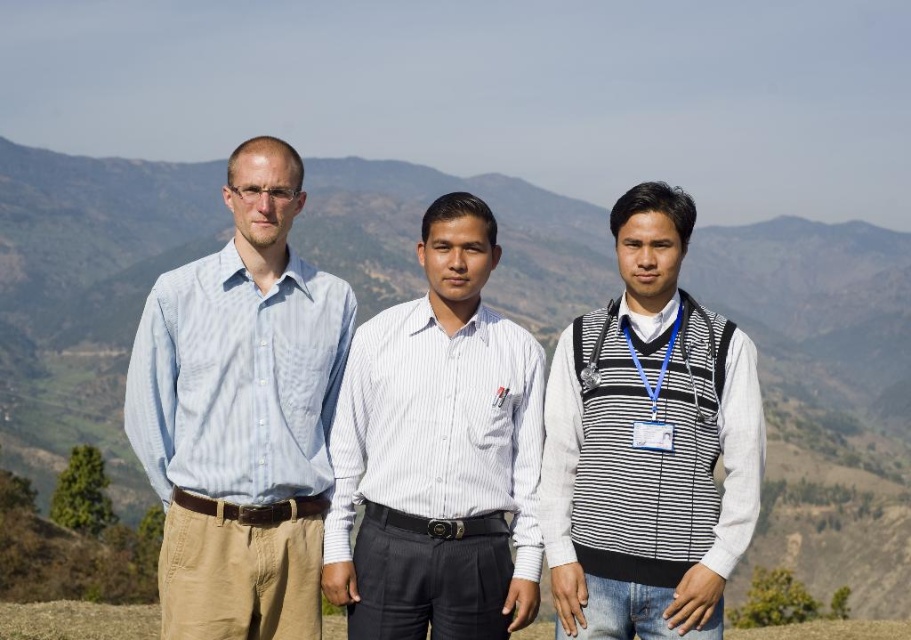
Question: Which object is closer to the camera taking this photo?

Choices:
 (A) silver metallic medal at center
 (B) striped sweater vest at center
 (C) white striped shirt at center

Answer: (B)

Question: Can you confirm if striped sweater vest at center is positioned to the right of white striped shirt at center?

Choices:
 (A) no
 (B) yes

Answer: (B)

Question: Does white striped shirt at center have a lesser width compared to silver metallic medal at center?

Choices:
 (A) no
 (B) yes

Answer: (A)

Question: Considering the real-world distances, which object is farthest from the striped sweater vest at center?

Choices:
 (A) light blue striped shirt at left
 (B) silver metallic medal at center
 (C) white striped shirt at center

Answer: (A)

Question: Does light blue striped shirt at left have a smaller size compared to white striped shirt at center?

Choices:
 (A) yes
 (B) no

Answer: (B)

Question: Which of the following is the farthest from the observer?

Choices:
 (A) (468, 620)
 (B) (212, 346)
 (C) (582, 365)

Answer: (C)